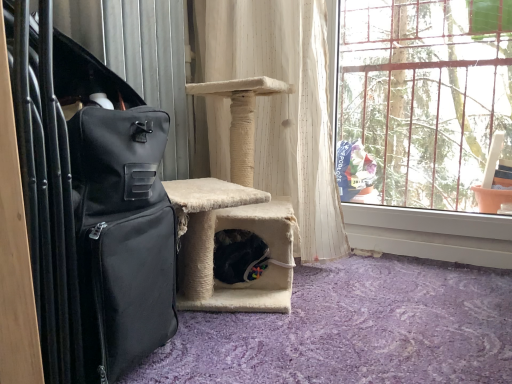
Question: Is black fabric suitcase at left positioned beyond the bounds of clear glass window at upper right?

Choices:
 (A) yes
 (B) no

Answer: (A)

Question: Considering the relative sizes of black fabric suitcase at left and clear glass window at upper right in the image provided, is black fabric suitcase at left wider than clear glass window at upper right?

Choices:
 (A) yes
 (B) no

Answer: (A)

Question: Can you confirm if black fabric suitcase at left is positioned to the left of clear glass window at upper right?

Choices:
 (A) no
 (B) yes

Answer: (B)

Question: Can you confirm if black fabric suitcase at left is thinner than clear glass window at upper right?

Choices:
 (A) no
 (B) yes

Answer: (A)

Question: Considering the relative sizes of black fabric suitcase at left and clear glass window at upper right in the image provided, is black fabric suitcase at left smaller than clear glass window at upper right?

Choices:
 (A) yes
 (B) no

Answer: (B)

Question: In the image, is black fabric suitcase at left on the left side or the right side of clear glass window at upper right?

Choices:
 (A) right
 (B) left

Answer: (B)

Question: Considering the positions of black fabric suitcase at left and clear glass window at upper right in the image, is black fabric suitcase at left wider or thinner than clear glass window at upper right?

Choices:
 (A) thin
 (B) wide

Answer: (B)

Question: In the image, is black fabric suitcase at left positioned in front of or behind clear glass window at upper right?

Choices:
 (A) behind
 (B) front

Answer: (B)

Question: Is black fabric suitcase at left situated inside clear glass window at upper right or outside?

Choices:
 (A) inside
 (B) outside

Answer: (B)

Question: Is clear glass window at upper right taller or shorter than black fabric suitcase at left?

Choices:
 (A) tall
 (B) short

Answer: (A)

Question: Is point (381, 46) positioned closer to the camera than point (125, 157)?

Choices:
 (A) farther
 (B) closer

Answer: (A)

Question: Considering the positions of clear glass window at upper right and black fabric suitcase at left in the image, is clear glass window at upper right bigger or smaller than black fabric suitcase at left?

Choices:
 (A) small
 (B) big

Answer: (A)

Question: In terms of width, does clear glass window at upper right look wider or thinner when compared to black fabric suitcase at left?

Choices:
 (A) wide
 (B) thin

Answer: (B)

Question: From the image's perspective, relative to white textured curtain at center, is clear glass window at upper right above or below?

Choices:
 (A) above
 (B) below

Answer: (B)

Question: Relative to white textured curtain at center, is clear glass window at upper right in front or behind?

Choices:
 (A) behind
 (B) front

Answer: (B)